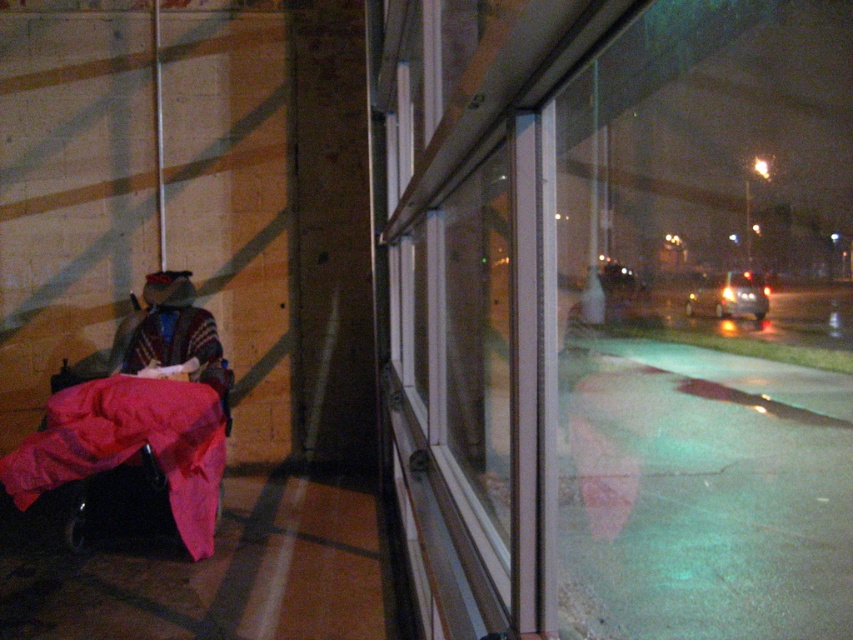
Does transparent glass window at center have a lesser width compared to velvet red blanket at lower left?

In fact, transparent glass window at center might be wider than velvet red blanket at lower left.

Is transparent glass window at center further to the viewer compared to velvet red blanket at lower left?

No, it is not.

This screenshot has width=853, height=640. Identify the location of transparent glass window at center. (618, 310).

At what (x,y) coordinates should I click in order to perform the action: click on transparent glass window at center. Please return your answer as a coordinate pair (x, y). This screenshot has width=853, height=640. Looking at the image, I should click on (618, 310).